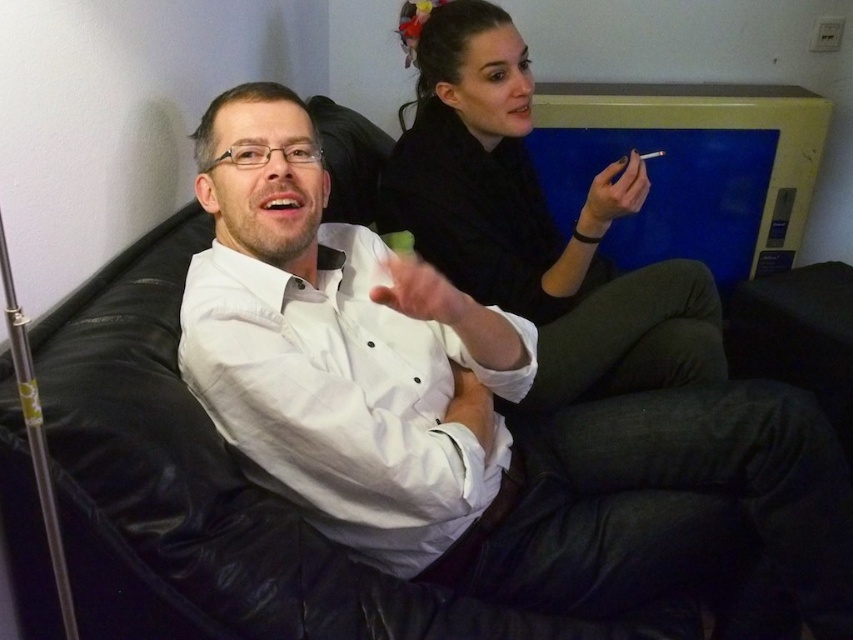
Question: Considering the relative positions of black matte shirt at upper right and matte white cigarette at upper center in the image provided, where is black matte shirt at upper right located with respect to matte white cigarette at upper center?

Choices:
 (A) above
 (B) below

Answer: (B)

Question: Which of the following is the farthest from the observer?

Choices:
 (A) black matte shirt at upper right
 (B) matte white cigarette at upper center

Answer: (B)

Question: Among these objects, which one is nearest to the camera?

Choices:
 (A) white matte shirt at center
 (B) black matte shirt at upper right

Answer: (A)

Question: Can you confirm if black matte shirt at upper right is thinner than matte white cigarette at upper center?

Choices:
 (A) yes
 (B) no

Answer: (B)

Question: Which of the following is the closest to the observer?

Choices:
 (A) matte white cigarette at upper center
 (B) black matte shirt at upper right
 (C) white matte shirt at center

Answer: (C)

Question: Is white matte shirt at center to the right of matte white cigarette at upper center from the viewer's perspective?

Choices:
 (A) yes
 (B) no

Answer: (B)